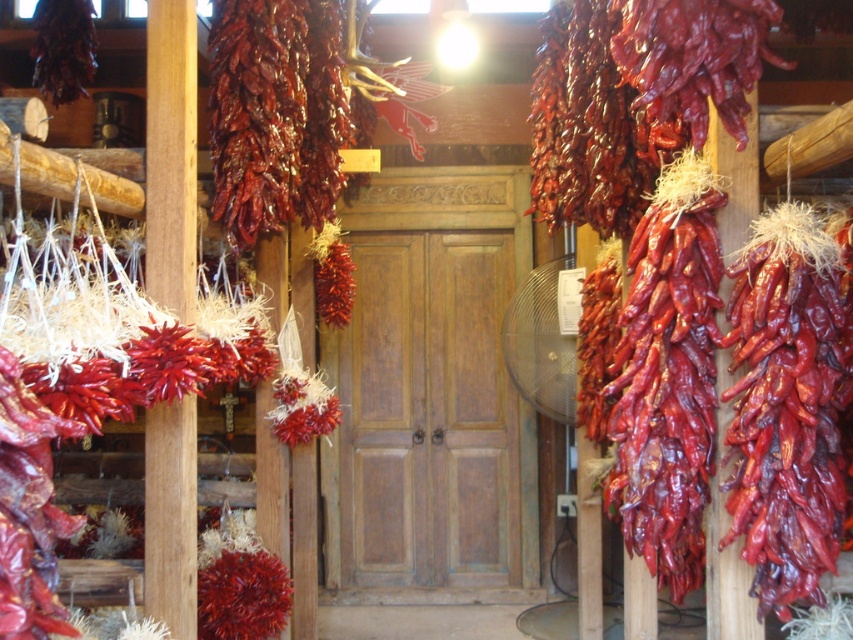
You are an interior designer assessing the rustic storage area. You notice two dried red peppers hanging in the room. Which of the two, the dried red pepper at right or the dried red pepper at center, is smaller in size?

The dried red pepper at right is smaller than the dried red pepper at center.

You are a delivery person carrying a 1.5 meter long box and need to pass through the space between the dried red pepper at right and the dried red pepper at center. Can you fit through the space without touching either pepper?

The distance between the dried red pepper at right and the dried red pepper at center is 1.53 meters. Since the box is 1.5 meters long, it can fit through the space as there is enough clearance. However, ensure proper handling to avoid contact with the peppers.

You are an interior designer planning to add a new light fixture. You see the dried red pepper at right and the wooden post at left. Which object is closer to you, the observer?

The dried red pepper at right is closer to you because it is in front of the wooden post at left.